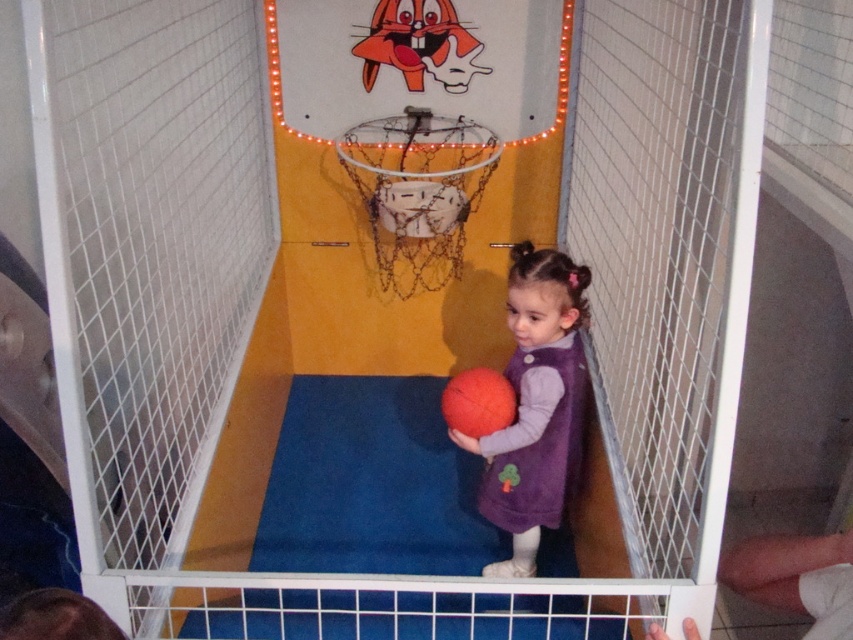
You are a child standing in the basketball arcade game. You see the purple fabric dress at center and the white mesh basketball hoop at center. Which object is located to the right of the other?

The purple fabric dress at center is positioned on the right side of white mesh basketball hoop at center.